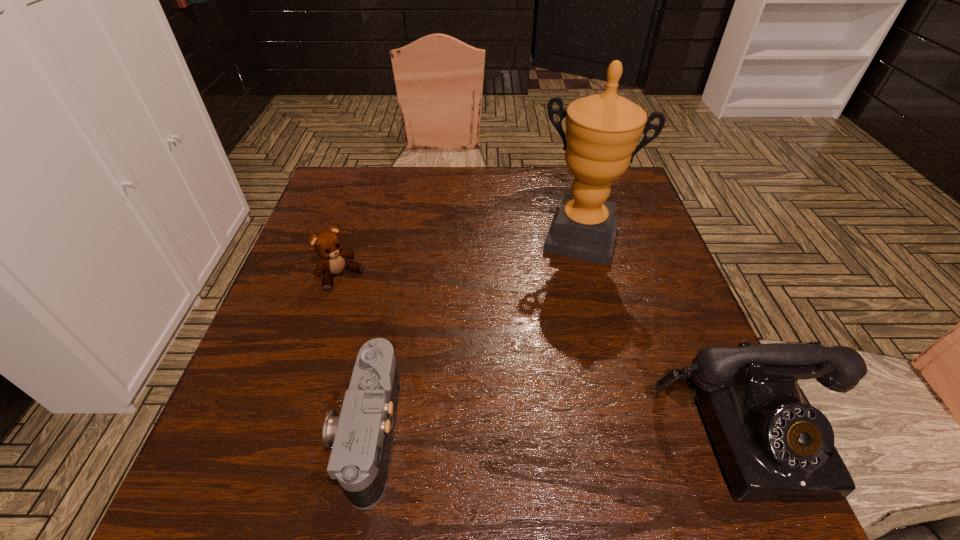
Identify the location of free space located at the front of the award with handles. (558, 315).

The width and height of the screenshot is (960, 540). Identify the location of camera present at the near edge. (361, 438).

At what (x,y) coordinates should I click in order to perform the action: click on telephone at the near edge. Please return your answer as a coordinate pair (x, y). Looking at the image, I should click on (774, 446).

Image resolution: width=960 pixels, height=540 pixels. I want to click on object that is positioned at the left edge, so click(327, 245).

Image resolution: width=960 pixels, height=540 pixels. In order to click on telephone that is at the right edge in this screenshot , I will do `click(774, 446)`.

Locate an element on the screen. award located at the right edge is located at coordinates (602, 131).

Locate an element on the screen. The width and height of the screenshot is (960, 540). object that is at the near right corner is located at coordinates (774, 446).

This screenshot has width=960, height=540. I want to click on vacant space at the far edge of the desktop, so click(480, 180).

Locate an element on the screen. vacant area at the near edge is located at coordinates (427, 409).

In the image, there is a desktop. Identify the location of vacant area at the left edge. The height and width of the screenshot is (540, 960). (301, 241).